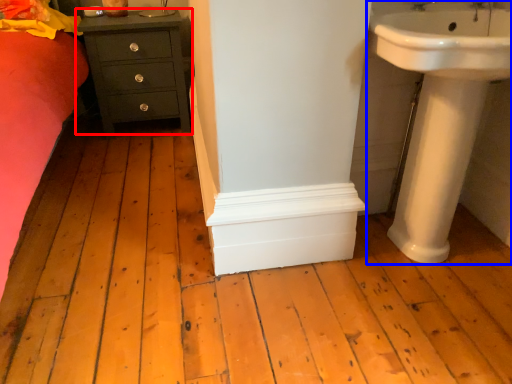
Question: Which object appears closest to the camera in this image, chest of drawers (highlighted by a red box) or sink (highlighted by a blue box)?

Choices:
 (A) chest of drawers
 (B) sink

Answer: (B)